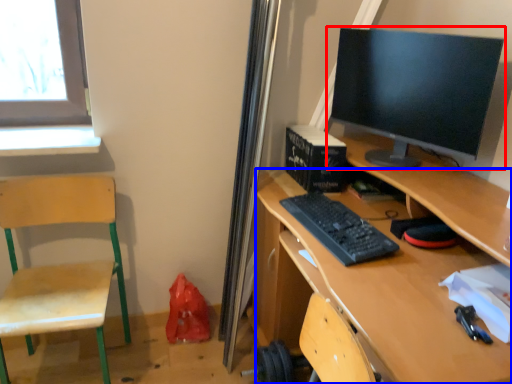
Question: Which object is closer to the camera taking this photo, computer monitor (highlighted by a red box) or desk (highlighted by a blue box)?

Choices:
 (A) computer monitor
 (B) desk

Answer: (B)